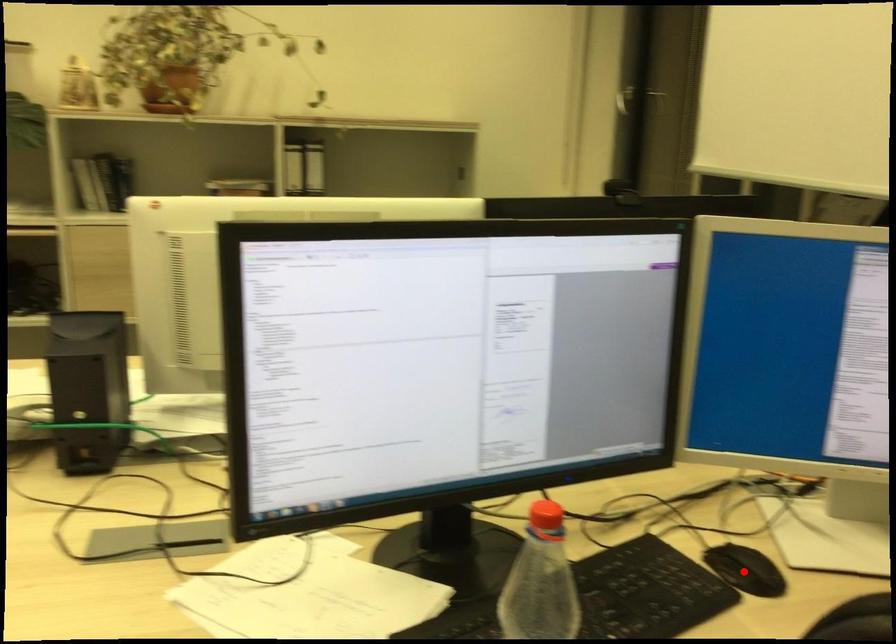
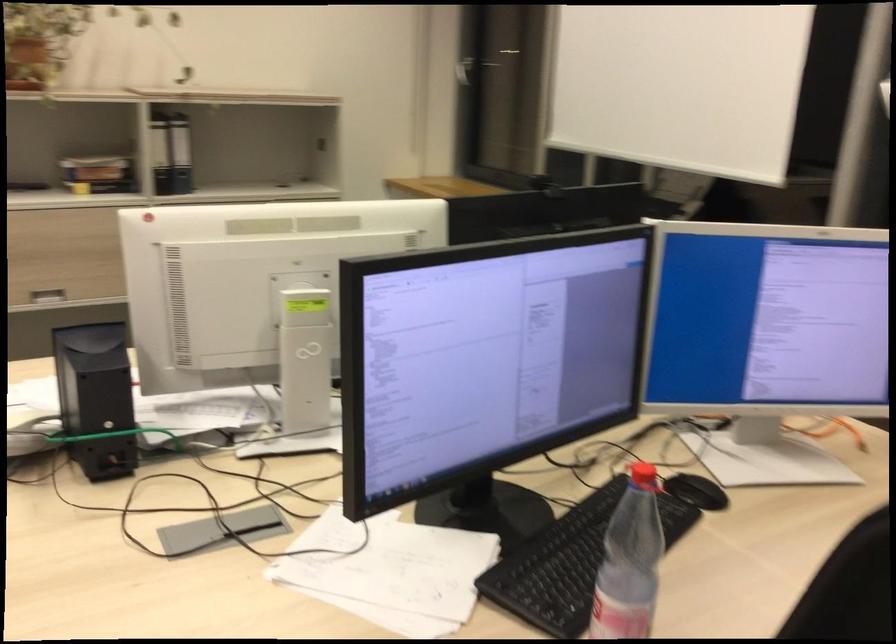
Question: A red point is marked in image1. In image2, is the corresponding 3D point closer to the camera or farther? Reply with the corresponding letter.

Choices:
 (A) The corresponding 3D point is closer.
 (B) The corresponding 3D point is farther.

Answer: (B)